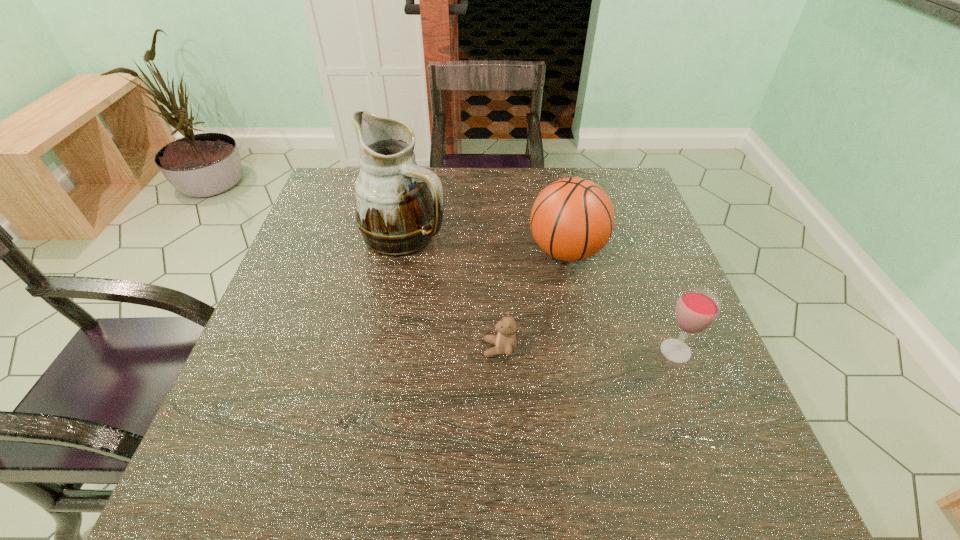
I want to click on vacant space that satisfies the following two spatial constraints: 1. on the front-facing side of the rightmost object; 2. on the left side of the shortest object, so click(x=500, y=351).

Identify the location of vacant space that satisfies the following two spatial constraints: 1. on the front side of the wineglass; 2. on the right side of the second tallest object. The height and width of the screenshot is (540, 960). (587, 351).

Where is `vacant point that satisfies the following two spatial constraints: 1. from the spout of the basketball; 2. on the left side of the pitcher`? The image size is (960, 540). vacant point that satisfies the following two spatial constraints: 1. from the spout of the basketball; 2. on the left side of the pitcher is located at coordinates (402, 252).

Identify the location of free space that satisfies the following two spatial constraints: 1. from the spout of the basketball; 2. on the right side of the pitcher. Image resolution: width=960 pixels, height=540 pixels. (402, 252).

Find the location of `free location that satisfies the following two spatial constraints: 1. on the front-facing side of the shortest object; 2. on the right side of the rightmost object`. free location that satisfies the following two spatial constraints: 1. on the front-facing side of the shortest object; 2. on the right side of the rightmost object is located at coordinates (500, 351).

Identify the location of free space that satisfies the following two spatial constraints: 1. on the front-facing side of the shortest object; 2. on the left side of the third tallest object. (500, 351).

At what (x,y) coordinates should I click in order to perform the action: click on free spot that satisfies the following two spatial constraints: 1. from the spout of the second tallest object; 2. on the right side of the tallest object. Please return your answer as a coordinate pair (x, y). Looking at the image, I should click on (402, 252).

You are a GUI agent. You are given a task and a screenshot of the screen. Output one action in this format:
    pyautogui.click(x=<x>, y=<y>)
    Task: Click on the vacant space that satisfies the following two spatial constraints: 1. from the spout of the tallest object; 2. on the right side of the third shortest object
    This screenshot has width=960, height=540.
    Given the screenshot: What is the action you would take?
    pyautogui.click(x=402, y=252)

Where is `vacant position in the image that satisfies the following two spatial constraints: 1. on the front-facing side of the wineglass; 2. on the left side of the second object from left to right`? vacant position in the image that satisfies the following two spatial constraints: 1. on the front-facing side of the wineglass; 2. on the left side of the second object from left to right is located at coordinates (500, 351).